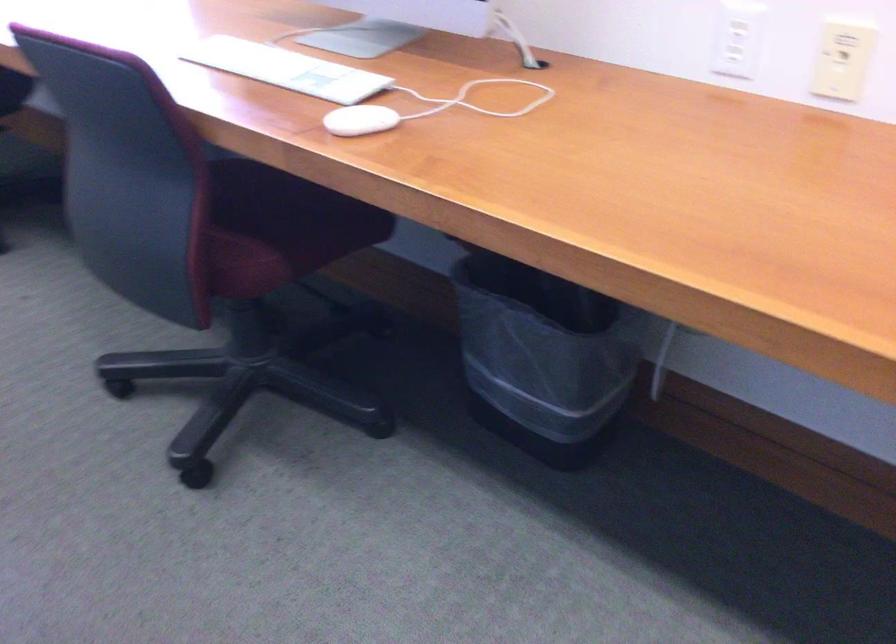
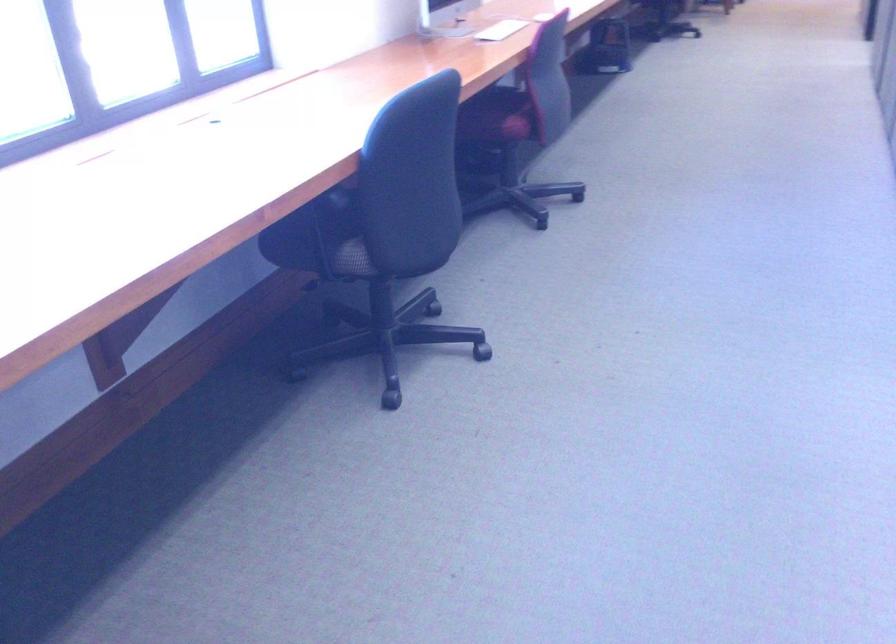
Question: I am providing you with two images of the same scene from different viewpoints. After the viewpoint changes to image2, which objects are now occluded?

Choices:
 (A) chair sitting surface
 (B) black trash can
 (C) plastic tissue package
 (D) white paper

Answer: (B)